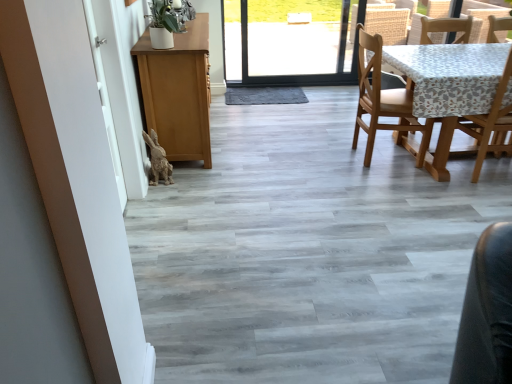
Question: From a real-world perspective, is wooden chair at right, marked as the 1th chair in a left-to-right arrangement, positioned above or below wooden chair at right?

Choices:
 (A) above
 (B) below

Answer: (B)

Question: Choose the correct answer: Is wooden chair at right, marked as the 1th chair in a left-to-right arrangement, inside wooden chair at right or outside it?

Choices:
 (A) inside
 (B) outside

Answer: (B)

Question: Estimate the real-world distances between objects in this image. Which object is farther from the white matte screen door at left?

Choices:
 (A) wooden chair at right
 (B) wooden chair at right, acting as the second chair starting from the left
 (C) wooden chair at right, marked as the 2th chair in a right-to-left arrangement

Answer: (A)

Question: Estimate the real-world distances between objects in this image. Which object is closer to the wooden chair at right?

Choices:
 (A) white matte screen door at left
 (B) wooden chair at right, acting as the second chair starting from the left
 (C) wooden chair at right, marked as the 1th chair in a left-to-right arrangement

Answer: (B)